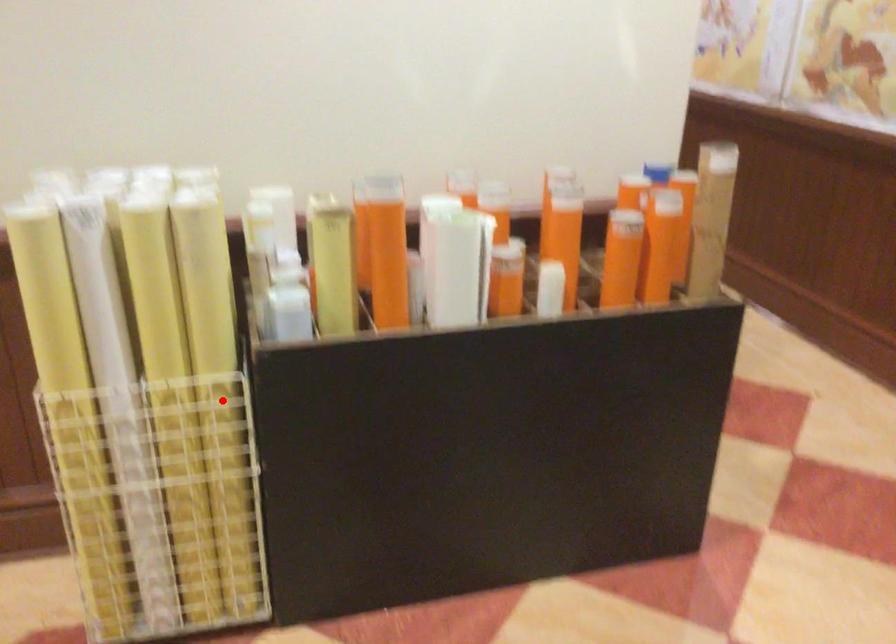
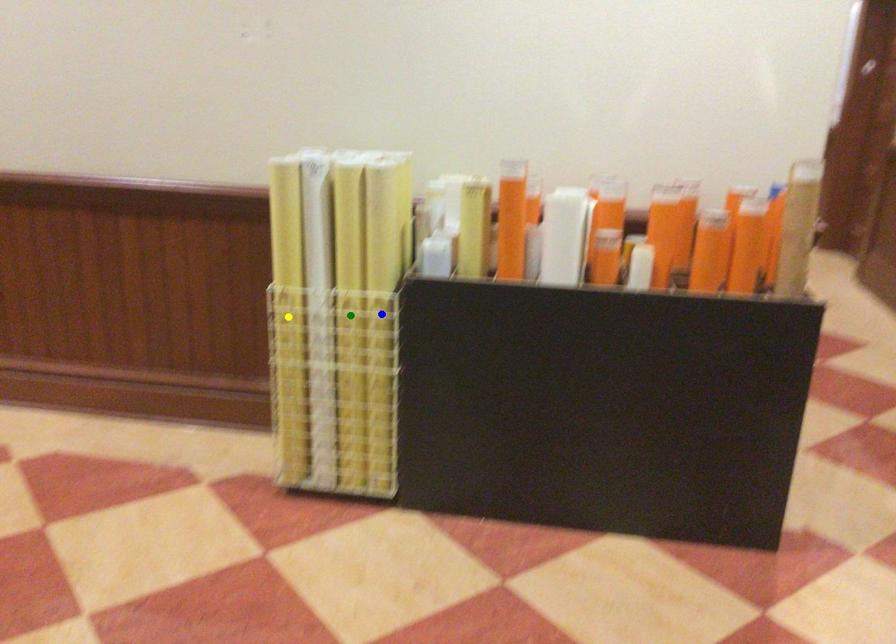
Question: I am providing you with two images of the same scene from different viewpoints. A red point is marked on the first image. You are given multiple points on the second image. Which point in image 2 is actually the same real-world point as the red point in image 1?

Choices:
 (A) yellow point
 (B) green point
 (C) blue point

Answer: (C)